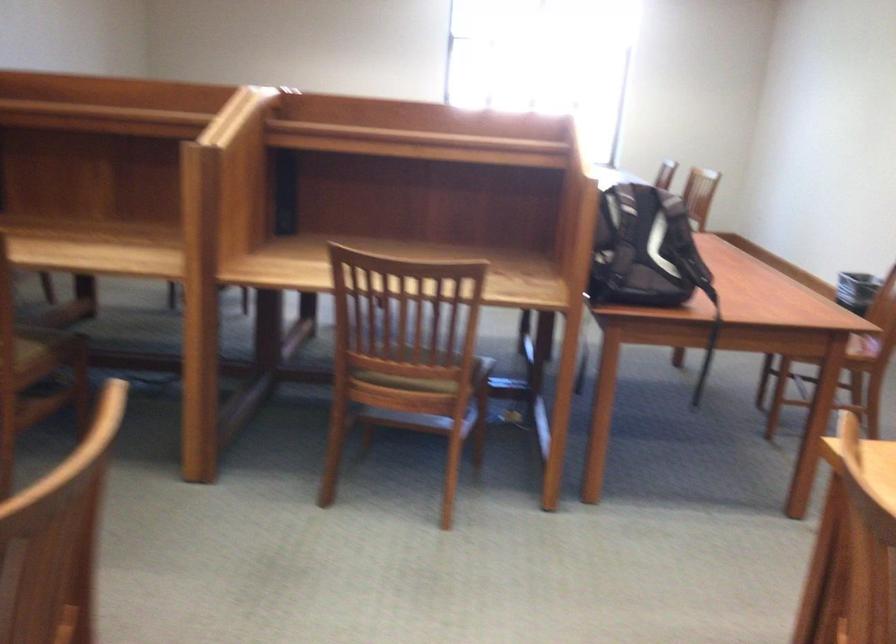
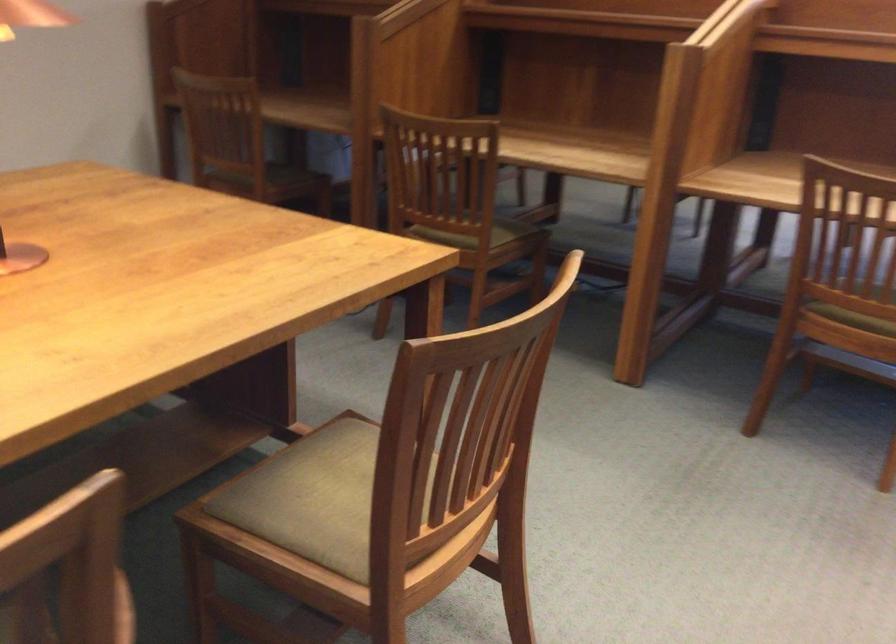
Question: The camera is either moving clockwise (left) or counter-clockwise (right) around the object. The first image is from the beginning of the video and the second image is from the end. Is the camera moving left or right when shooting the video?

Choices:
 (A) Left
 (B) Right

Answer: (B)